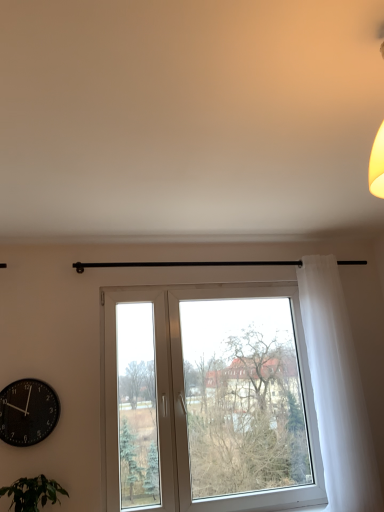
Question: Looking at their shapes, would you say black matte wall clock at lower left is wider or thinner than white plastic window at center?

Choices:
 (A) wide
 (B) thin

Answer: (B)

Question: From their relative heights in the image, would you say black matte wall clock at lower left is taller or shorter than white plastic window at center?

Choices:
 (A) short
 (B) tall

Answer: (A)

Question: Considering the real-world distances, which object is closest to the green leafy plant at lower left?

Choices:
 (A) black matte wall clock at lower left
 (B) white plastic window at center
 (C) white sheer curtain at right

Answer: (A)

Question: Considering the real-world distances, which object is farthest from the black matte wall clock at lower left?

Choices:
 (A) white plastic window at center
 (B) green leafy plant at lower left
 (C) white sheer curtain at right

Answer: (C)